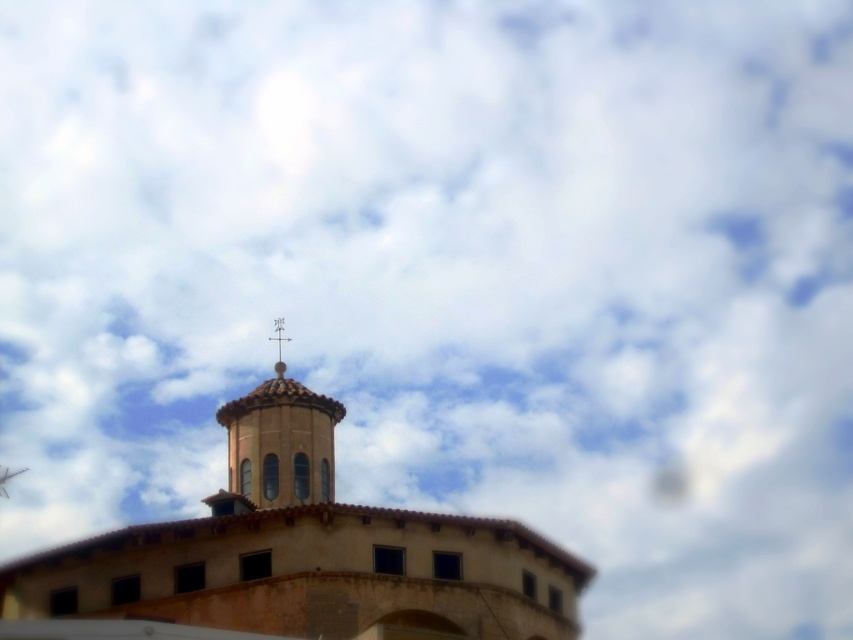
You are standing in front of the building and want to take a photo of both the brown textured dome at center and the matte orange bell tower at center. Which one will appear larger in your photo?

The brown textured dome at center will appear larger in the photo because it is closer to the viewer than the matte orange bell tower at center.

You are standing in front of the building and want to locate the matte orange bell tower at center and the metallic cross at upper center. Which one is positioned higher up on the building?

The metallic cross at upper center is positioned higher up on the building than the matte orange bell tower at center.

You are standing in front of the building and notice a point at coordinates (277, 445). What object is located at that point?

The point at coordinates (277, 445) indicates the matte orange bell tower at center.